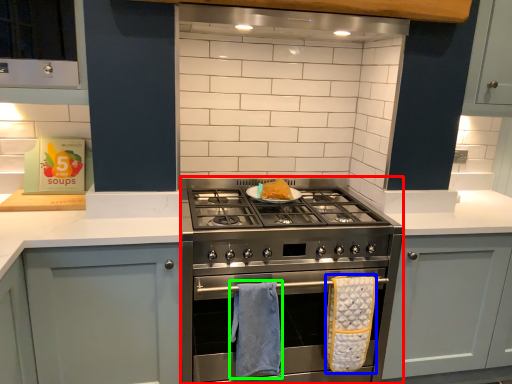
Question: Which is nearer to the appliance (highlighted by a red box)? bath towel (highlighted by a blue box) or bath towel (highlighted by a green box).

Choices:
 (A) bath towel
 (B) bath towel

Answer: (B)